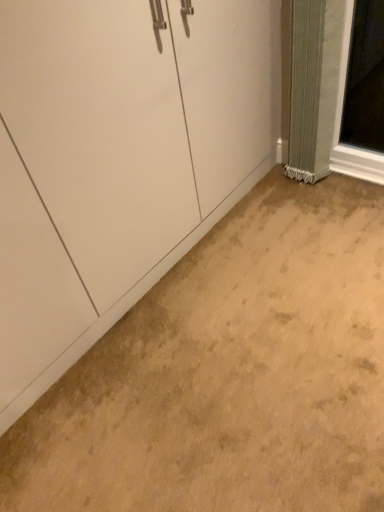
Question: In terms of width, does beige carpet at lower center look wider or thinner when compared to green textured curtain at right?

Choices:
 (A) wide
 (B) thin

Answer: (A)

Question: Is beige carpet at lower center inside the boundaries of green textured curtain at right, or outside?

Choices:
 (A) inside
 (B) outside

Answer: (B)

Question: From a real-world perspective, relative to green textured curtain at right, is beige carpet at lower center vertically above or below?

Choices:
 (A) below
 (B) above

Answer: (A)

Question: From a real-world perspective, is green textured curtain at right positioned above or below beige carpet at lower center?

Choices:
 (A) below
 (B) above

Answer: (B)

Question: Is green textured curtain at right in front of or behind beige carpet at lower center in the image?

Choices:
 (A) front
 (B) behind

Answer: (B)

Question: From the image's perspective, relative to beige carpet at lower center, is green textured curtain at right above or below?

Choices:
 (A) below
 (B) above

Answer: (B)

Question: Is point (339, 27) closer or farther from the camera than point (48, 395)?

Choices:
 (A) closer
 (B) farther

Answer: (B)